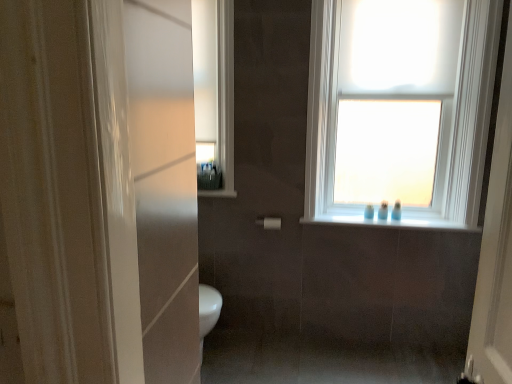
Find the location of `vacant area that lies to the right of blue plastic bottle at upper right, which is counted as the 2th toiletry, starting from the left`. vacant area that lies to the right of blue plastic bottle at upper right, which is counted as the 2th toiletry, starting from the left is located at coordinates (400, 221).